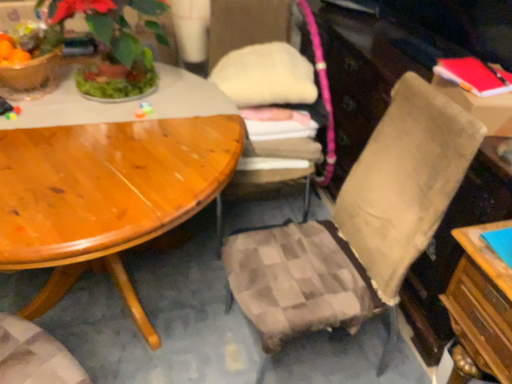
Question: Which direction should I rotate to face plaid fabric chair at center, which ranks as the first chair in left-to-right order, — up or down?

Choices:
 (A) up
 (B) down

Answer: (A)

Question: Is matte plastic flowerpot at upper left positioned before green leafy plant at upper left?

Choices:
 (A) yes
 (B) no

Answer: (B)

Question: Is matte plastic flowerpot at upper left to the left of green leafy plant at upper left from the viewer's perspective?

Choices:
 (A) yes
 (B) no

Answer: (A)

Question: Is matte plastic flowerpot at upper left smaller than green leafy plant at upper left?

Choices:
 (A) no
 (B) yes

Answer: (B)

Question: Could you tell me if matte plastic flowerpot at upper left is turned towards green leafy plant at upper left?

Choices:
 (A) yes
 (B) no

Answer: (B)

Question: Is green leafy plant at upper left completely or partially inside matte plastic flowerpot at upper left?

Choices:
 (A) yes
 (B) no

Answer: (B)

Question: Is the surface of matte plastic flowerpot at upper left in direct contact with green leafy plant at upper left?

Choices:
 (A) no
 (B) yes

Answer: (A)

Question: Does red matte book at upper right have a lesser width compared to matte plastic flowerpot at upper left?

Choices:
 (A) no
 (B) yes

Answer: (B)

Question: Would you say red matte book at upper right contains matte plastic flowerpot at upper left?

Choices:
 (A) no
 (B) yes

Answer: (A)

Question: Could you tell me if red matte book at upper right is turned towards matte plastic flowerpot at upper left?

Choices:
 (A) yes
 (B) no

Answer: (A)

Question: Considering the relative sizes of red matte book at upper right and matte plastic flowerpot at upper left in the image provided, is red matte book at upper right shorter than matte plastic flowerpot at upper left?

Choices:
 (A) no
 (B) yes

Answer: (B)

Question: Is red matte book at upper right not inside matte plastic flowerpot at upper left?

Choices:
 (A) no
 (B) yes

Answer: (B)

Question: Is red matte book at upper right positioned before matte plastic flowerpot at upper left?

Choices:
 (A) yes
 (B) no

Answer: (A)

Question: From the image's perspective, does matte plastic flowerpot at upper left appear higher than plaid fabric chair at center, the 2th chair from the right?

Choices:
 (A) no
 (B) yes

Answer: (B)